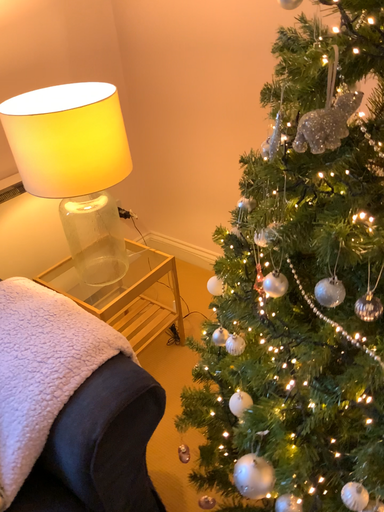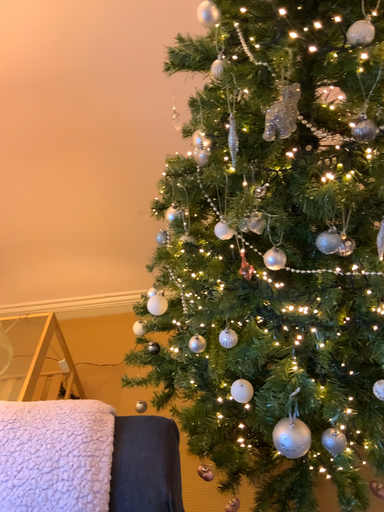
Question: Which way did the camera rotate in the video?

Choices:
 (A) rotated downward
 (B) rotated upward

Answer: (B)